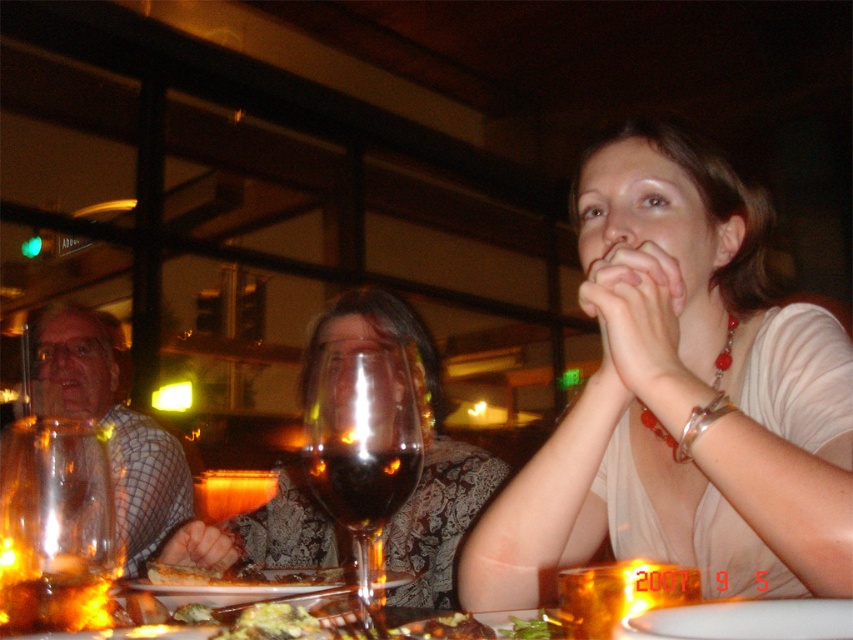
Question: Is transparent glass wine glass at center below brown crumbly bread at center?

Choices:
 (A) yes
 (B) no

Answer: (B)

Question: Which point appears closest to the camera in this image?

Choices:
 (A) (161, 582)
 (B) (341, 493)

Answer: (B)

Question: Is white matte shirt at center above green leafy salad at center?

Choices:
 (A) no
 (B) yes

Answer: (B)

Question: Which point is farther to the camera?

Choices:
 (A) (415, 625)
 (B) (282, 620)

Answer: (A)

Question: Which is nearer to the white matte shirt at center?

Choices:
 (A) plaid shirt at left
 (B) green leafy salad at center
 (C) transparent glass wine glass at center

Answer: (C)

Question: Observing the image, what is the correct spatial positioning of plaid shirt at left in reference to golden brown bread at center?

Choices:
 (A) right
 (B) left

Answer: (B)